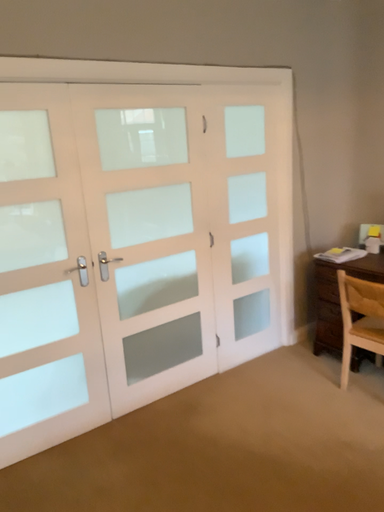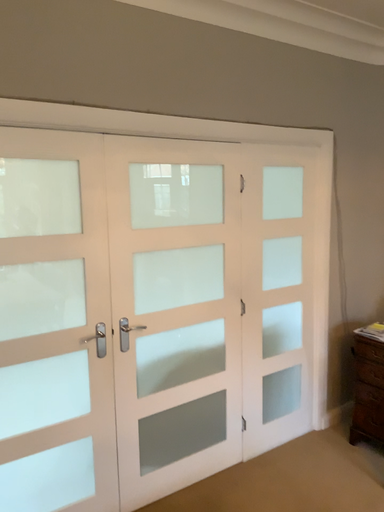
Question: Which way did the camera rotate in the video?

Choices:
 (A) rotated downward
 (B) rotated upward

Answer: (B)